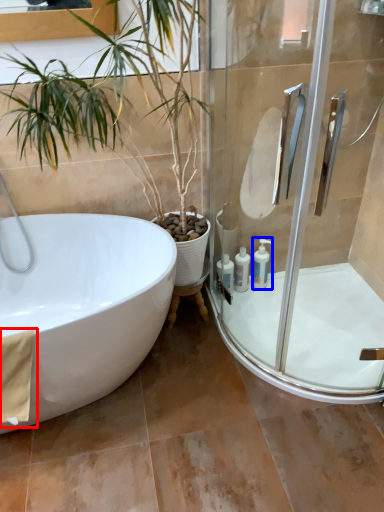
Question: Which object appears farthest to the camera in this image, material (highlighted by a red box) or toiletry (highlighted by a blue box)?

Choices:
 (A) material
 (B) toiletry

Answer: (B)